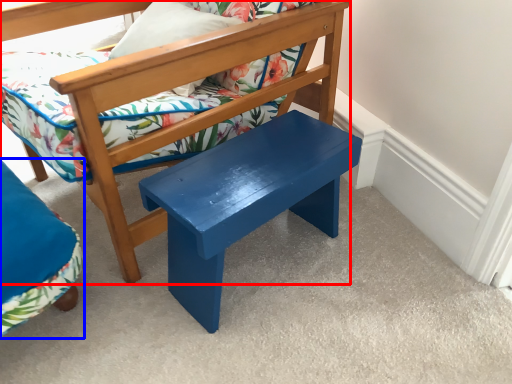
Question: Which object is further to the camera taking this photo, chair (highlighted by a red box) or chair (highlighted by a blue box)?

Choices:
 (A) chair
 (B) chair

Answer: (B)